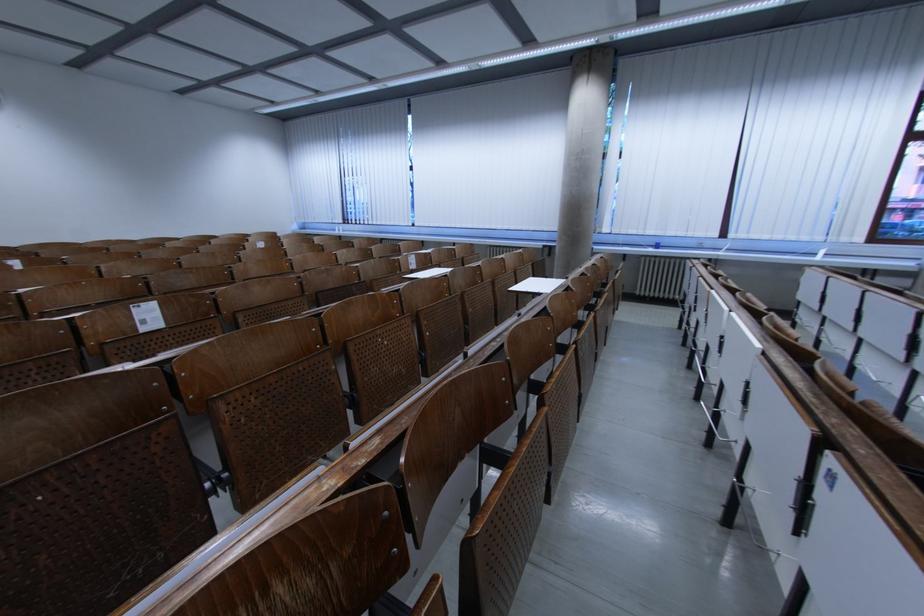
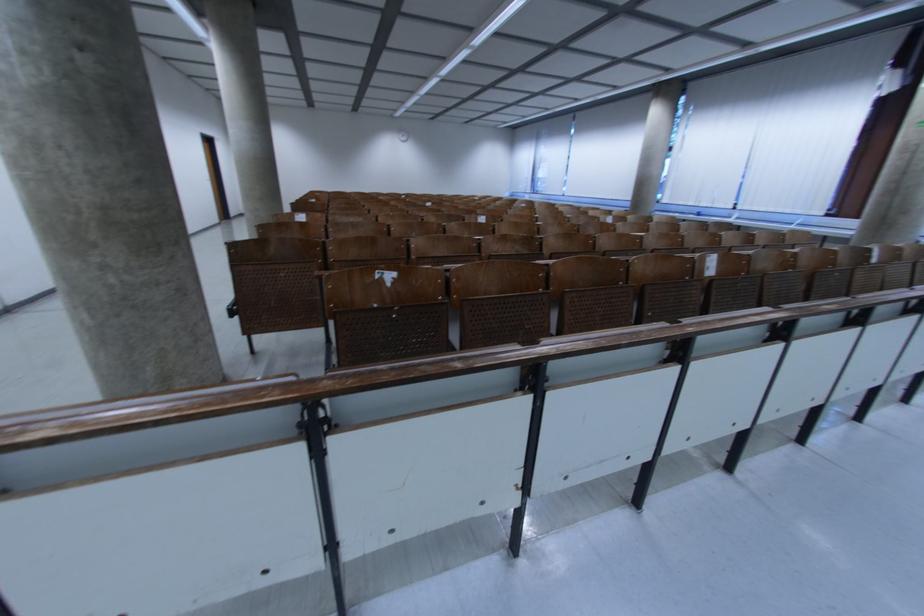
Find the pixel in the second image that matches (x=609, y=159) in the first image.

(675, 152)